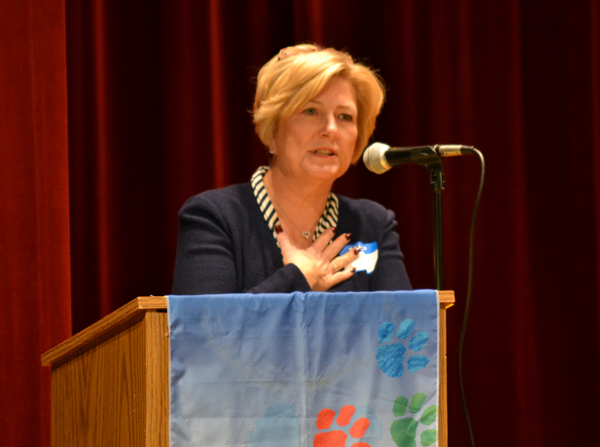
Find the location of a particular element. The height and width of the screenshot is (447, 600). wood podium is located at coordinates (113, 364).